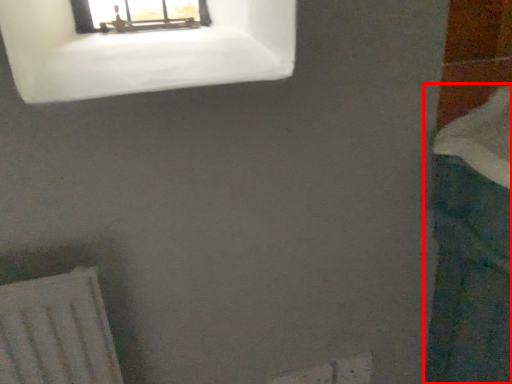
Question: Observing the image, what is the correct spatial positioning of bath (annotated by the red box) in reference to window?

Choices:
 (A) left
 (B) right

Answer: (B)